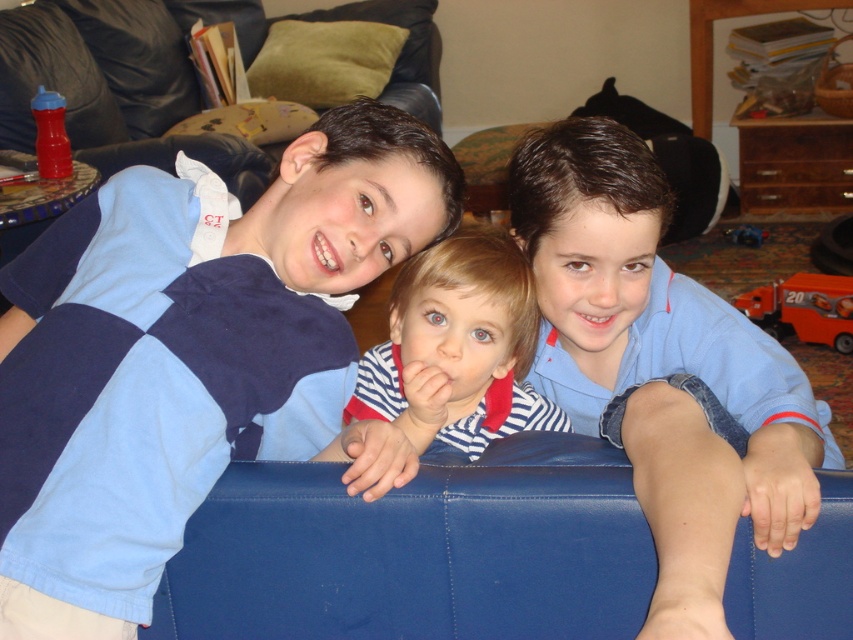
Is point (583, 406) positioned before point (735, 232)?

Yes, point (583, 406) is closer to viewer.

Is point (720, 596) more distant than point (722, 230)?

No, (720, 596) is closer to viewer.

You are a GUI agent. You are given a task and a screenshot of the screen. Output one action in this format:
    pyautogui.click(x=<x>, y=<y>)
    Task: Click on the blue denim jeans at lower right
    The height and width of the screenshot is (640, 853).
    Given the screenshot: What is the action you would take?
    pyautogui.click(x=660, y=368)

Consider the image. Can you confirm if striped fabric shirt at center is shorter than rubberized red sippy cup at left?

Incorrect, striped fabric shirt at center's height does not fall short of rubberized red sippy cup at left's.

Can you confirm if striped fabric shirt at center is positioned to the left of rubberized red sippy cup at left?

In fact, striped fabric shirt at center is to the right of rubberized red sippy cup at left.

Is point (451, 252) in front of point (50, 140)?

Yes, point (451, 252) is closer to viewer.

You are a GUI agent. You are given a task and a screenshot of the screen. Output one action in this format:
    pyautogui.click(x=<x>, y=<y>)
    Task: Click on the striped fabric shirt at center
    The height and width of the screenshot is (640, 853).
    Given the screenshot: What is the action you would take?
    pyautogui.click(x=457, y=348)

Who is taller, blue denim jeans at lower right or rubberized red sippy cup at left?

blue denim jeans at lower right

Which is below, blue denim jeans at lower right or rubberized red sippy cup at left?

blue denim jeans at lower right is below.

You are a GUI agent. You are given a task and a screenshot of the screen. Output one action in this format:
    pyautogui.click(x=<x>, y=<y>)
    Task: Click on the blue denim jeans at lower right
    The height and width of the screenshot is (640, 853).
    Given the screenshot: What is the action you would take?
    pyautogui.click(x=660, y=368)

At what (x,y) coordinates should I click in order to perform the action: click on blue denim jeans at lower right. Please return your answer as a coordinate pair (x, y). This screenshot has width=853, height=640. Looking at the image, I should click on (660, 368).